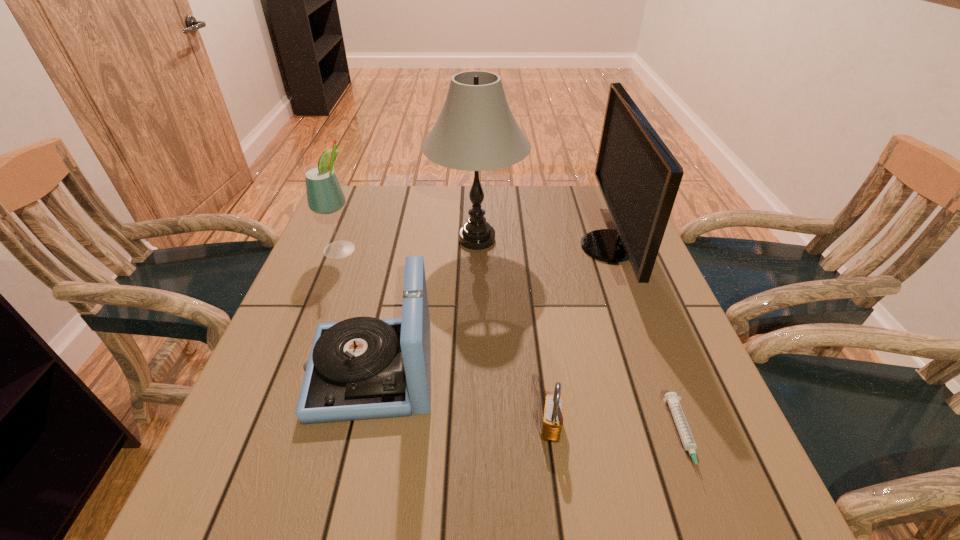
This screenshot has width=960, height=540. I want to click on free space at the near right corner, so click(684, 508).

This screenshot has width=960, height=540. What are the coordinates of `unoccupied area between the phonograph record and the syringe` in the screenshot? It's located at (x=528, y=405).

Identify the location of free space between the fifth tallest object and the fifth shortest object. The image size is (960, 540). point(580,337).

Image resolution: width=960 pixels, height=540 pixels. Find the location of `free space that is in between the fifth tallest object and the tallest object`. free space that is in between the fifth tallest object and the tallest object is located at coordinates (514, 333).

Where is `vacant space that's between the computer monitor and the syringe`? vacant space that's between the computer monitor and the syringe is located at coordinates (646, 342).

This screenshot has width=960, height=540. What are the coordinates of `vacant area between the third tallest object and the shortest object` in the screenshot? It's located at (512, 343).

Identify the location of unoccupied area between the shortest object and the fourth shortest object. (512, 343).

Locate an element on the screen. vacant area that lies between the fourth tallest object and the shortest object is located at coordinates (528, 405).

In order to click on vacant point located between the second tallest object and the padlock in this screenshot , I will do `click(580, 337)`.

Locate an element on the screen. The image size is (960, 540). free space between the padlock and the alcohol is located at coordinates (445, 338).